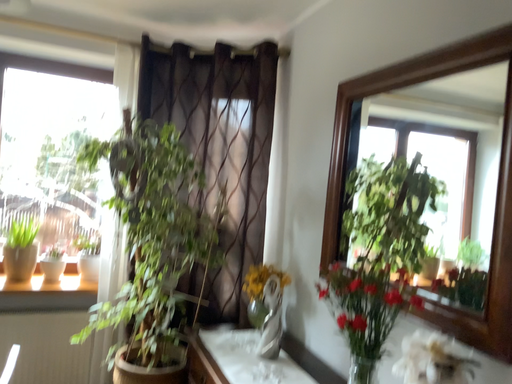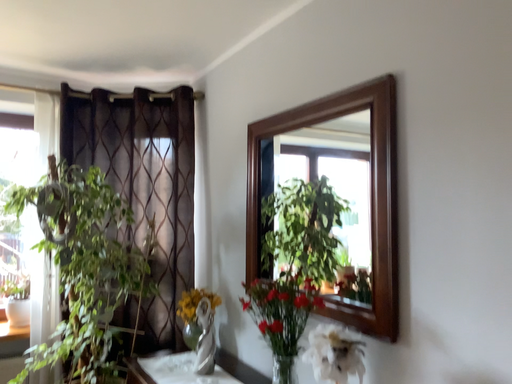
Question: How did the camera likely rotate when shooting the video?

Choices:
 (A) rotated right
 (B) rotated left

Answer: (A)